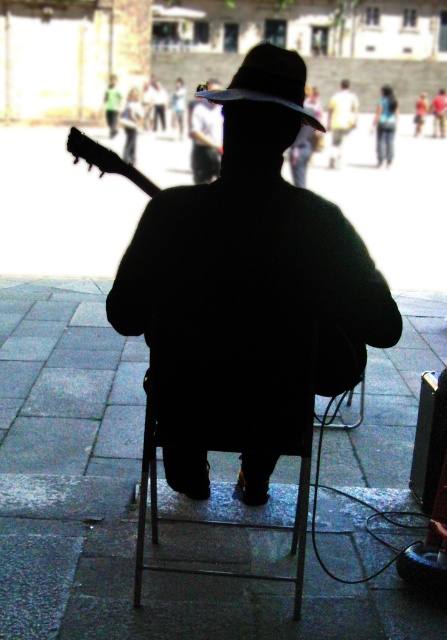
Question: Is gray concrete pavement at center wider than matte black guitar at left?

Choices:
 (A) yes
 (B) no

Answer: (A)

Question: Which point is closer to the camera?

Choices:
 (A) (387, 120)
 (B) (227, 200)

Answer: (B)

Question: Observing the image, what is the correct spatial positioning of black matte guitar at center in reference to light yellow shirt at center?

Choices:
 (A) below
 (B) above

Answer: (A)

Question: Can you confirm if black matte guitar at center is bigger than matte black guitar at left?

Choices:
 (A) yes
 (B) no

Answer: (A)

Question: Which object is positioned farthest from the gray concrete pavement at center?

Choices:
 (A) black felt fedora at center
 (B) blue denim jeans at upper center

Answer: (B)

Question: Among these objects, which one is farthest from the camera?

Choices:
 (A) matte black guitar at left
 (B) matte black guitar at center

Answer: (A)